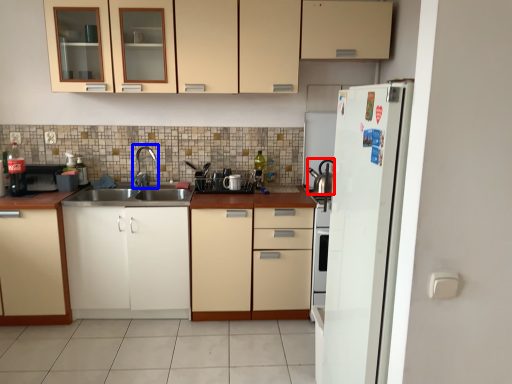
Question: Among these objects, which one is nearest to the camera, tea pot (highlighted by a red box) or faucet (highlighted by a blue box)?

Choices:
 (A) tea pot
 (B) faucet

Answer: (B)